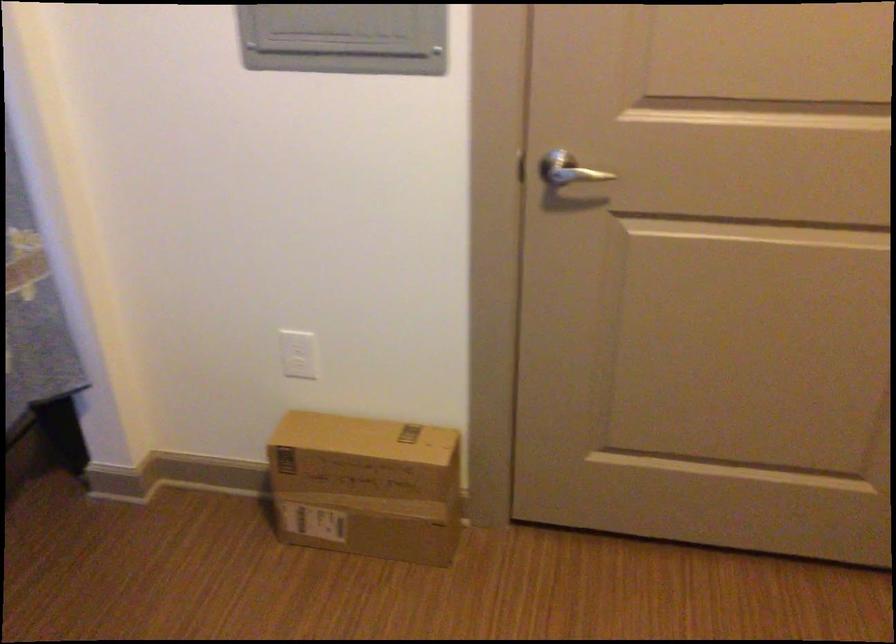
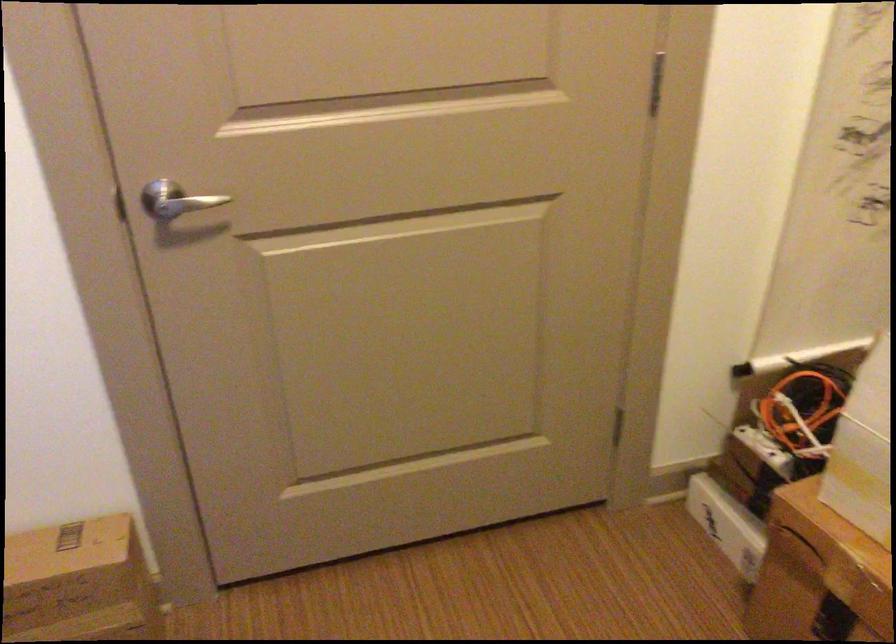
Question: How did the camera likely rotate?

Choices:
 (A) Left
 (B) Right
 (C) Up
 (D) Down

Answer: (B)